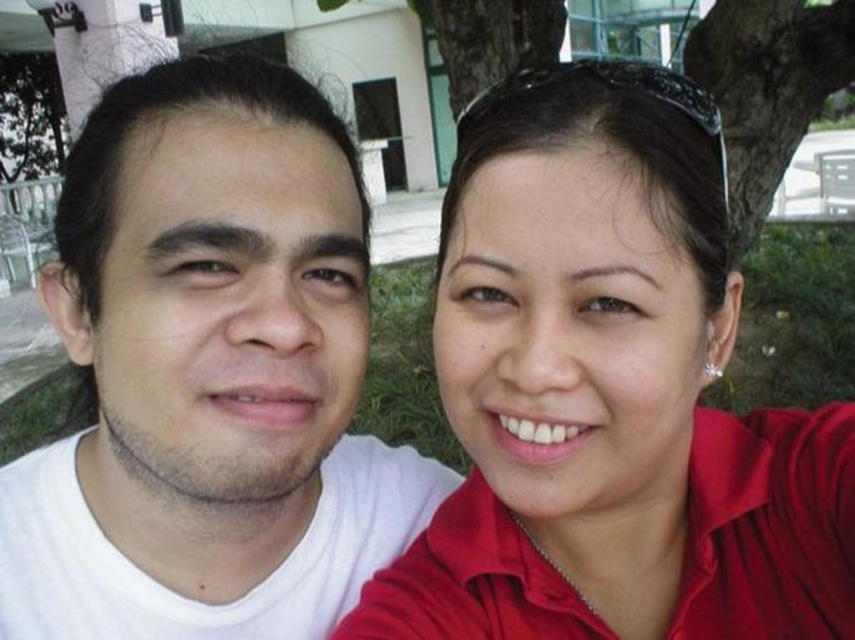
Question: Can you confirm if matte red shirt at right is positioned to the right of white matte shirt at left?

Choices:
 (A) yes
 (B) no

Answer: (A)

Question: Is matte red shirt at right wider than white matte shirt at left?

Choices:
 (A) yes
 (B) no

Answer: (B)

Question: Can you confirm if matte red shirt at right is smaller than white matte shirt at left?

Choices:
 (A) yes
 (B) no

Answer: (A)

Question: Which object appears closest to the camera in this image?

Choices:
 (A) matte red shirt at right
 (B) white matte shirt at left

Answer: (A)